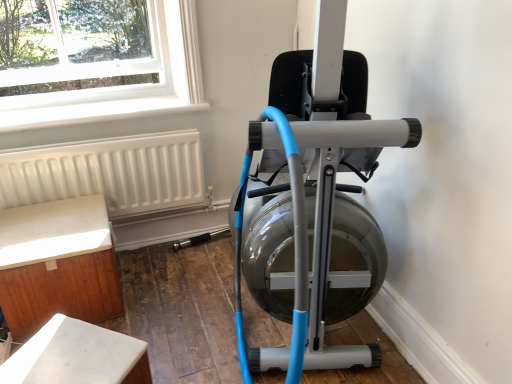
At what (x,y) coordinates should I click in order to perform the action: click on free space above white marble table at lower left, arranged as the 1th furniture when viewed from the front (from a real-world perspective). Please return your answer as a coordinate pair (x, y). Image resolution: width=512 pixels, height=384 pixels. Looking at the image, I should click on tap(72, 355).